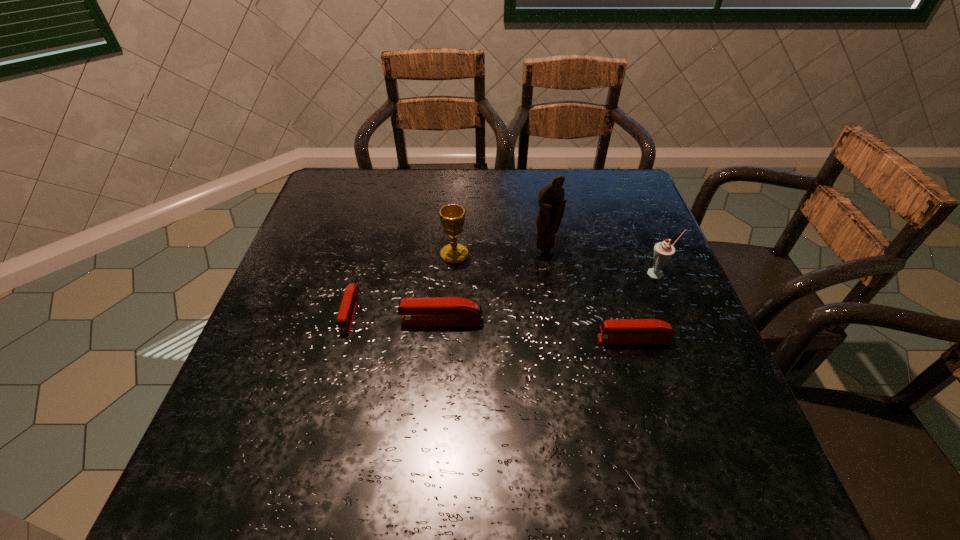
Where is `the leftmost stapler`? the leftmost stapler is located at coordinates (345, 318).

At what (x,y) coordinates should I click in order to perform the action: click on the shortest object. Please return your answer as a coordinate pair (x, y). Image resolution: width=960 pixels, height=540 pixels. Looking at the image, I should click on (345, 318).

The height and width of the screenshot is (540, 960). I want to click on the second stapler from left to right, so click(x=433, y=311).

The image size is (960, 540). What are the coordinates of `the fifth tallest object` in the screenshot? It's located at (623, 331).

Where is `the rightmost stapler`? This screenshot has height=540, width=960. the rightmost stapler is located at coordinates (623, 331).

You are a GUI agent. You are given a task and a screenshot of the screen. Output one action in this format:
    pyautogui.click(x=<x>, y=<y>)
    Task: Click on the chalice
    The width and height of the screenshot is (960, 540).
    Given the screenshot: What is the action you would take?
    pyautogui.click(x=452, y=216)

Find the location of a particular element. the fourth object from left to right is located at coordinates (551, 202).

Image resolution: width=960 pixels, height=540 pixels. I want to click on figurine, so click(x=551, y=202).

Locate an element on the screen. the third farthest object is located at coordinates (663, 251).

Where is `the rightmost object`? The height and width of the screenshot is (540, 960). the rightmost object is located at coordinates (663, 251).